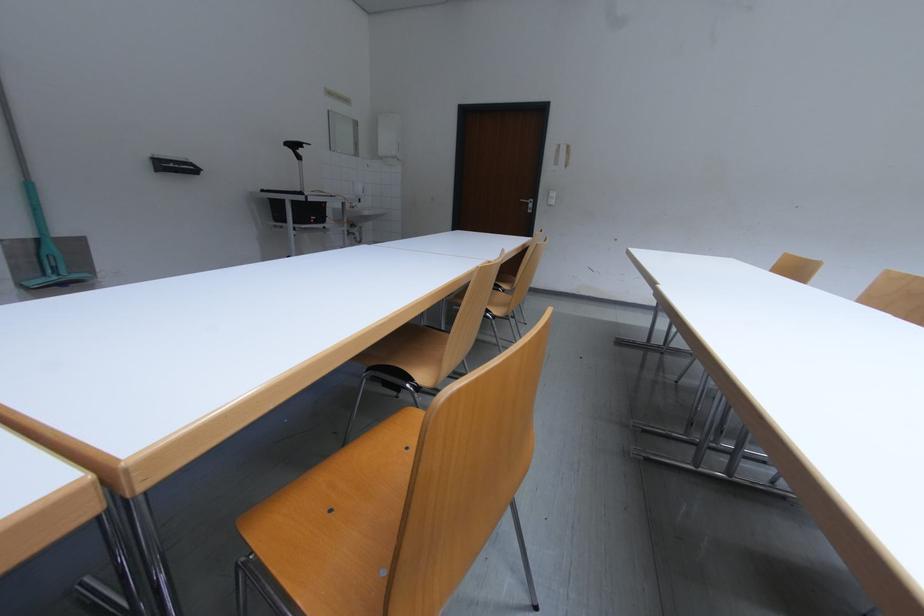
Describe the element at coordinates (551, 197) in the screenshot. This screenshot has height=616, width=924. I see `the light switch` at that location.